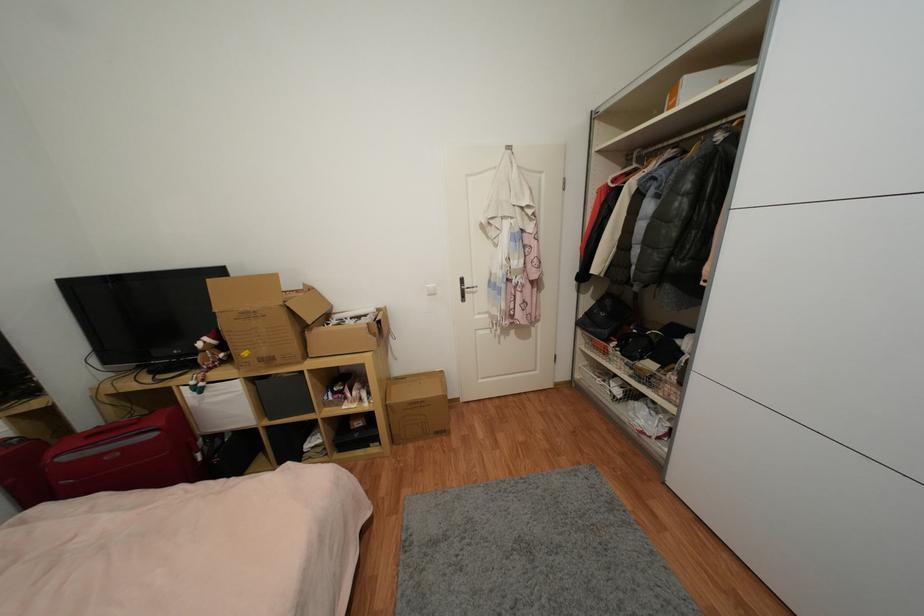
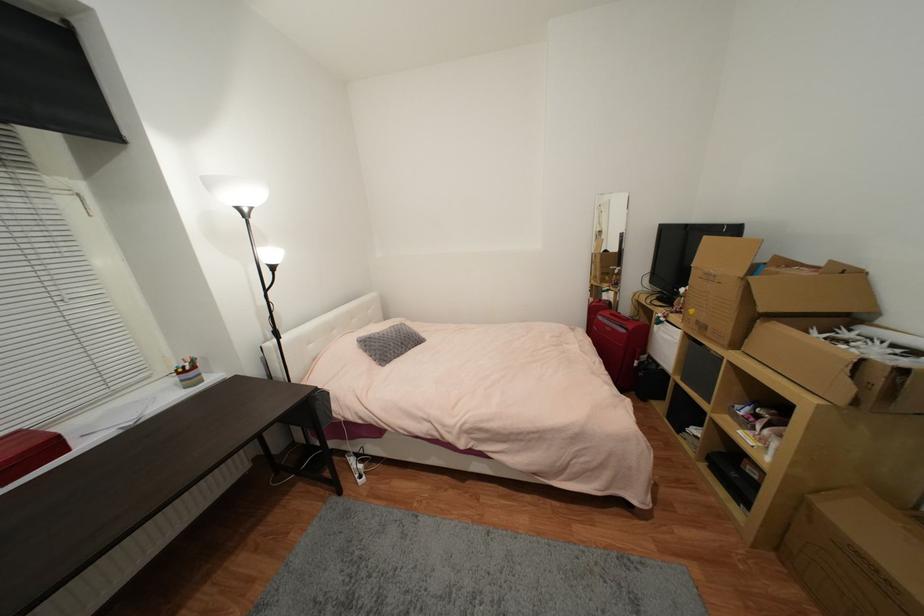
The point at (397, 440) is marked in the first image. Where is the corresponding point in the second image?

(782, 546)